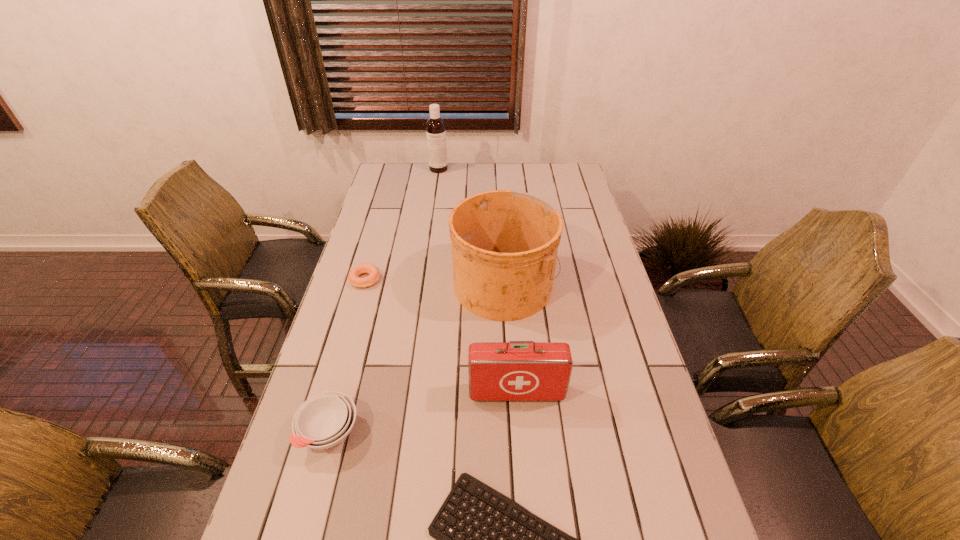
This screenshot has height=540, width=960. What are the coordinates of `free space between the dishwasher detergent and the third shortest object` in the screenshot? It's located at (384, 300).

Where is `vacant space that's between the bucket and the first-aid kit`? Image resolution: width=960 pixels, height=540 pixels. vacant space that's between the bucket and the first-aid kit is located at coordinates (510, 339).

The image size is (960, 540). Find the location of `free area in between the fourth tallest object and the farthest object`. free area in between the fourth tallest object and the farthest object is located at coordinates (384, 300).

Where is `vacant area that lies between the first-aid kit and the bucket`? The image size is (960, 540). vacant area that lies between the first-aid kit and the bucket is located at coordinates [510, 339].

Point out which object is positioned as the second nearest to the third object from left to right. Please provide its 2D coordinates. Your answer should be formatted as a tuple, i.e. [(x, y)], where the tuple contains the x and y coordinates of a point satisfying the conditions above.

[(372, 270)]

At what (x,y) coordinates should I click in order to perform the action: click on object that can be found as the fifth closest to the fifth farthest object. Please return your answer as a coordinate pair (x, y). Image resolution: width=960 pixels, height=540 pixels. Looking at the image, I should click on (435, 126).

This screenshot has width=960, height=540. In order to click on vacant space that satisfies the following two spatial constraints: 1. on the label side of the bucket; 2. on the left side of the third object from left to right in this screenshot , I will do `click(422, 284)`.